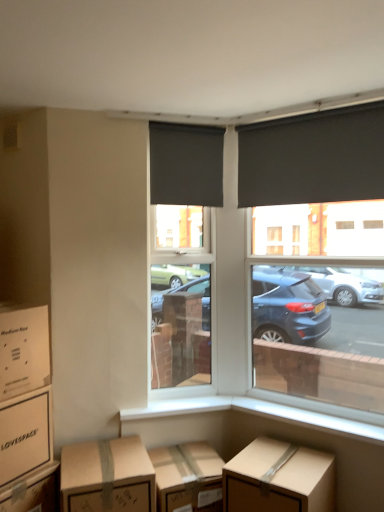
Question: In terms of height, does matte black roller blind at upper right, marked as the 1th window blind in a right-to-left arrangement, look taller or shorter compared to brown cardboard box at lower left, acting as the third box starting from the right?

Choices:
 (A) tall
 (B) short

Answer: (A)

Question: From the image's perspective, is matte black roller blind at upper right, marked as the 1th window blind in a right-to-left arrangement, above or below brown cardboard box at lower left, positioned as the 3th box in left-to-right order?

Choices:
 (A) above
 (B) below

Answer: (A)

Question: Estimate the real-world distances between objects in this image. Which object is farther from the cardboard box at lower left, marked as the fifth box in a right-to-left arrangement?

Choices:
 (A) brown cardboard box at lower left, positioned as the 3th box in left-to-right order
 (B) white smooth window sill at lower center
 (C) brown cardboard box at lower center
 (D) brown cardboard box at lower left, the second box when ordered from right to left
 (E) matte black roller blind at center

Answer: (E)

Question: Which object is positioned closest to the matte black roller blind at center?

Choices:
 (A) brown cardboard box at lower center
 (B) cardboard box at lower left, marked as the fifth box in a right-to-left arrangement
 (C) brown cardboard box at lower center, positioned as the first box in right-to-left order
 (D) matte black roller blind at upper right, marked as the 1th window blind in a right-to-left arrangement
 (E) matte black roller blind at upper left, acting as the 2th window blind starting from the right

Answer: (E)